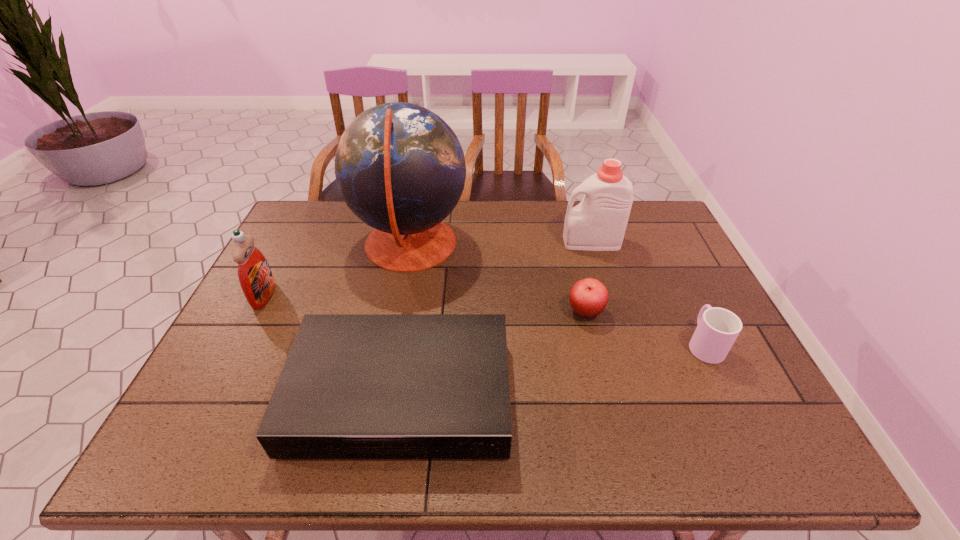
The height and width of the screenshot is (540, 960). What are the coordinates of `free region that satisfies the following two spatial constraints: 1. on the front surface of the apple; 2. on the right side of the nearer detergent` in the screenshot? It's located at (255, 312).

Locate an element on the screen. free space that satisfies the following two spatial constraints: 1. on the handle side of the farther detergent; 2. with the handle on the side of the cup is located at coordinates (622, 344).

Find the location of a particular element. The height and width of the screenshot is (540, 960). free spot that satisfies the following two spatial constraints: 1. with the handle on the side of the cup; 2. on the handle side of the right detergent is located at coordinates (655, 242).

This screenshot has width=960, height=540. Identify the location of vacant area that satisfies the following two spatial constraints: 1. on the handle side of the second tallest object; 2. at the front of the CD player for disc insertion. (638, 394).

Find the location of a particular element. vacant space that satisfies the following two spatial constraints: 1. with the handle on the side of the rightmost object; 2. with the Americas facing the viewer on the tallest object is located at coordinates (657, 246).